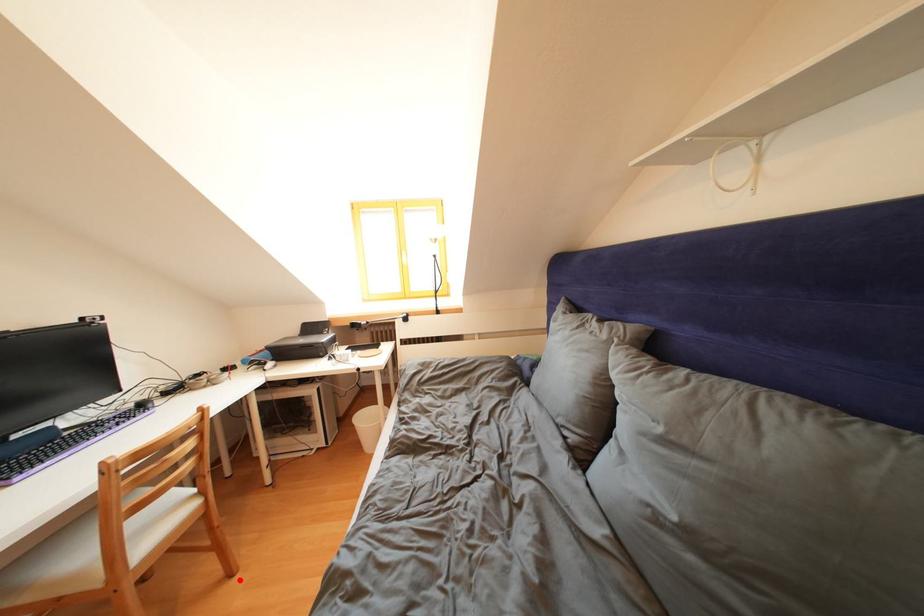
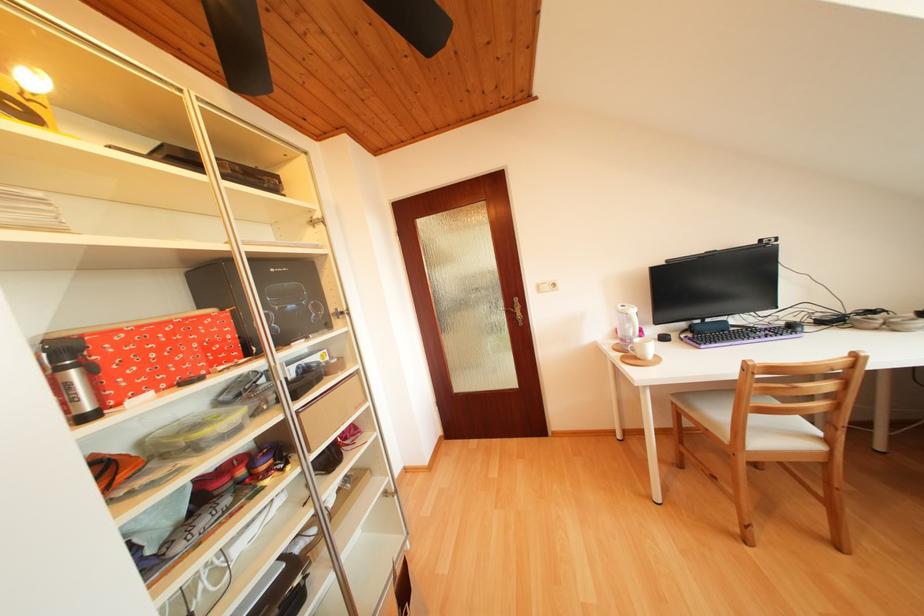
Locate, in the second image, the point that corresponds to the highlighted location in the first image.

(847, 553)